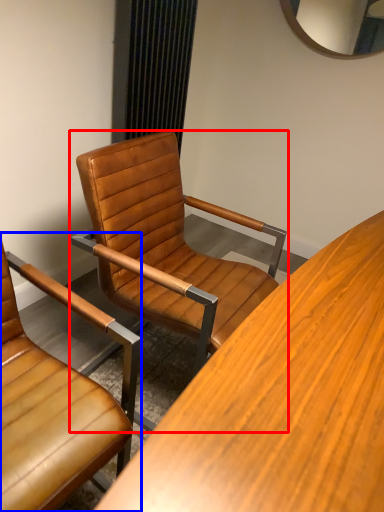
Question: Which point is further to the camera, chair (highlighted by a red box) or chair (highlighted by a blue box)?

Choices:
 (A) chair
 (B) chair

Answer: (A)